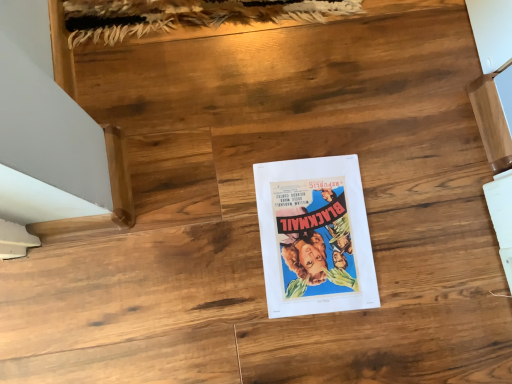
Describe the element at coordinates (314, 236) in the screenshot. This screenshot has width=512, height=384. I see `white paper poster at center` at that location.

Find the location of `white paper poster at center`. white paper poster at center is located at coordinates (314, 236).

What is the approximate height of white paper poster at center?

white paper poster at center is 1.13 centimeters tall.

I want to click on white paper poster at center, so click(314, 236).